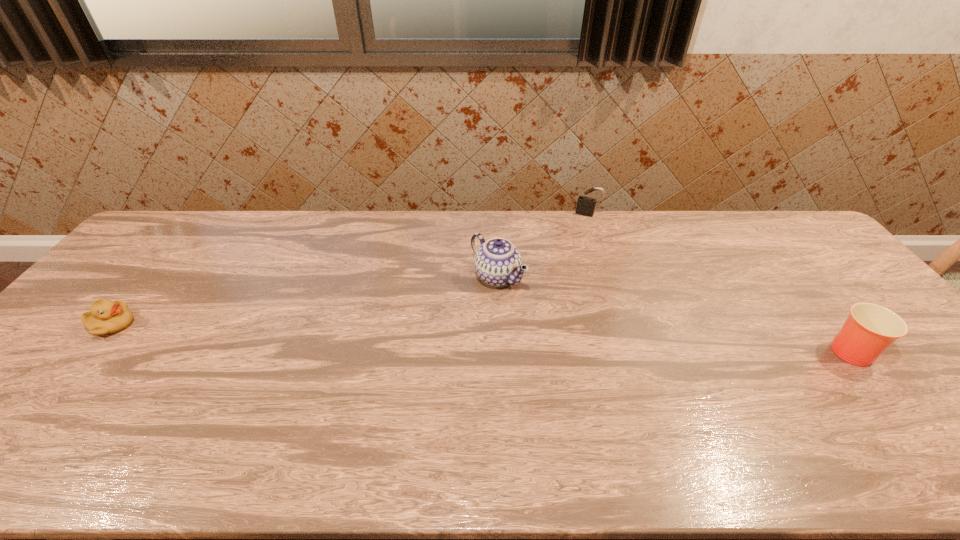
I want to click on blank region between the duckling and the rightmost object, so click(480, 336).

Locate an element on the screen. The image size is (960, 540). object that is the third closest to the second object from right to left is located at coordinates (105, 317).

Identify the location of object that is the closest to the padlock. (498, 262).

The image size is (960, 540). Find the location of `free space that satisfies the following two spatial constraints: 1. on the front side of the farthest object; 2. on the left side of the rightmost object`. free space that satisfies the following two spatial constraints: 1. on the front side of the farthest object; 2. on the left side of the rightmost object is located at coordinates (631, 348).

In order to click on blank space that satisfies the following two spatial constraints: 1. on the front side of the third nearest object; 2. on the left side of the rightmost object in this screenshot , I will do `click(500, 348)`.

What are the coordinates of `free spot that satisfies the following two spatial constraints: 1. on the front side of the padlock; 2. on the left side of the rightmost object` in the screenshot? It's located at (631, 348).